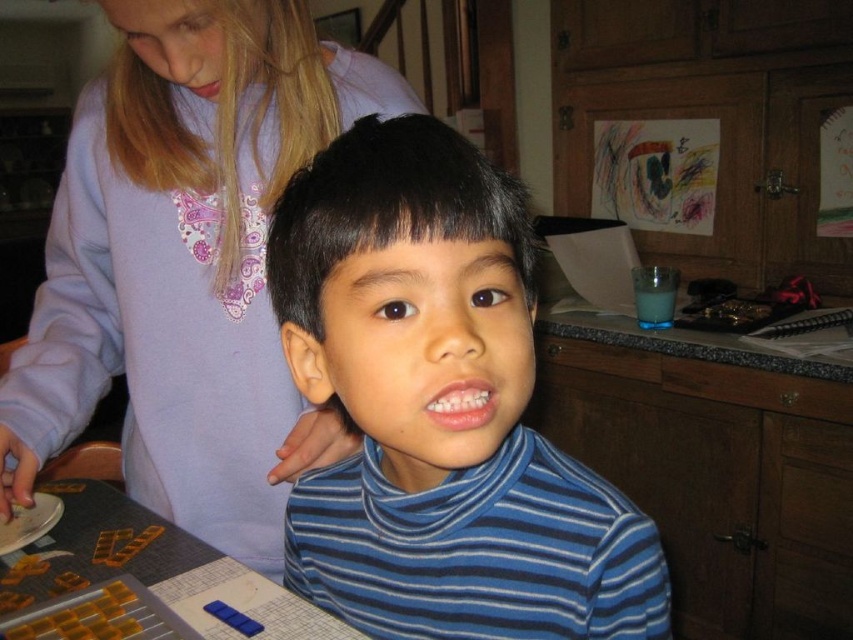
Which is more to the right, blue striped turtleneck at center or matte pink lips at upper center?

Positioned to the right is blue striped turtleneck at center.

Is blue striped turtleneck at center bigger than matte pink lips at upper center?

Yes.

Is point (561, 570) positioned behind point (212, 76)?

No, (561, 570) is closer to viewer.

You are a GUI agent. You are given a task and a screenshot of the screen. Output one action in this format:
    pyautogui.click(x=<x>, y=<y>)
    Task: Click on the blue striped turtleneck at center
    Image resolution: width=853 pixels, height=640 pixels.
    Given the screenshot: What is the action you would take?
    pyautogui.click(x=425, y=416)

Does pink glossy lips at center have a greater height compared to matte pink lips at upper center?

Indeed, pink glossy lips at center has a greater height compared to matte pink lips at upper center.

Who is more forward, (445,403) or (212,92)?

Point (445,403) is in front.

The image size is (853, 640). Identify the location of pink glossy lips at center. (461, 404).

Is purple soft sweater at upper left closer to the viewer compared to pink glossy lips at center?

No, it is behind pink glossy lips at center.

Between point (148, 416) and point (463, 428), which one is positioned behind?

The point (148, 416) is behind.

Identify the location of purple soft sweater at upper left. The image size is (853, 640). (186, 266).